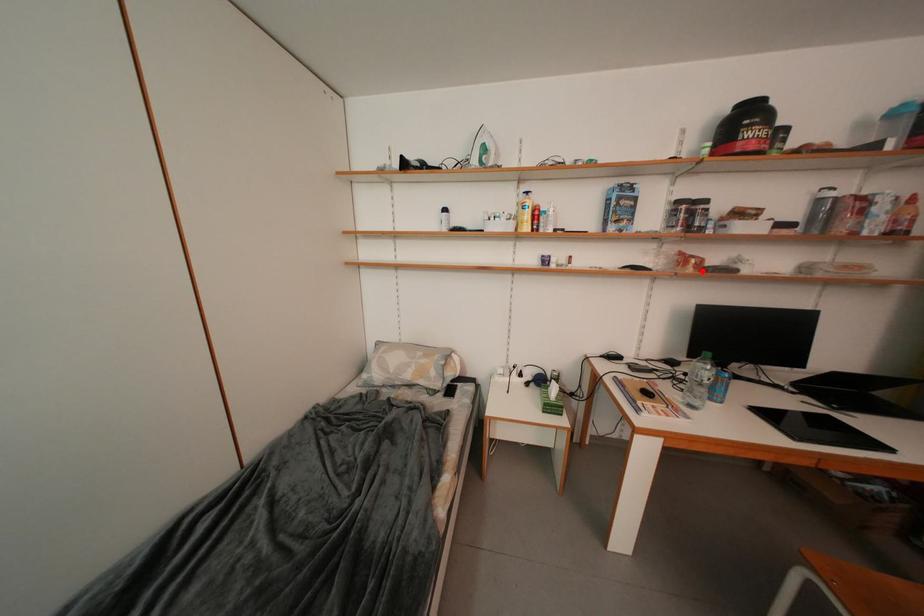
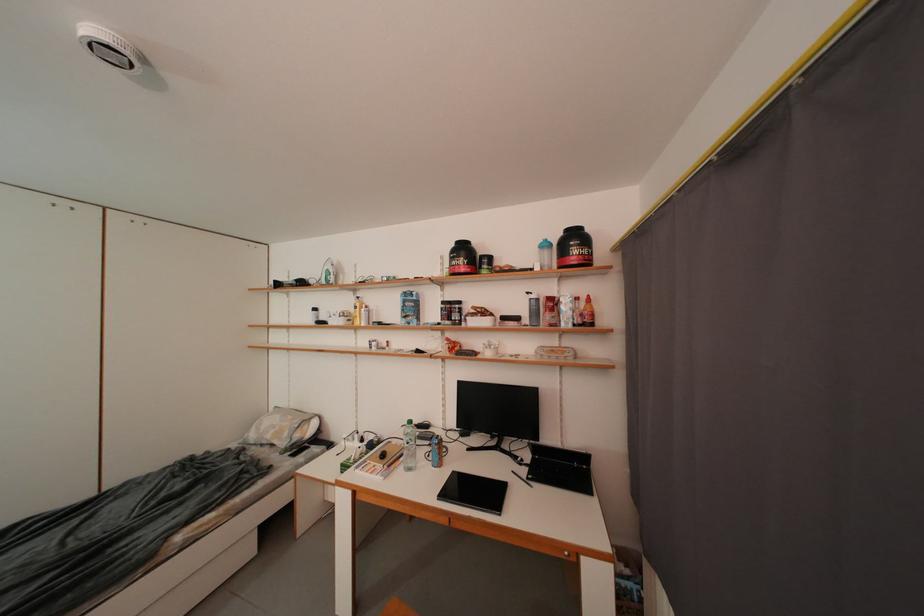
Find the pixel in the second image that matches the highlighted location in the first image.

(457, 355)